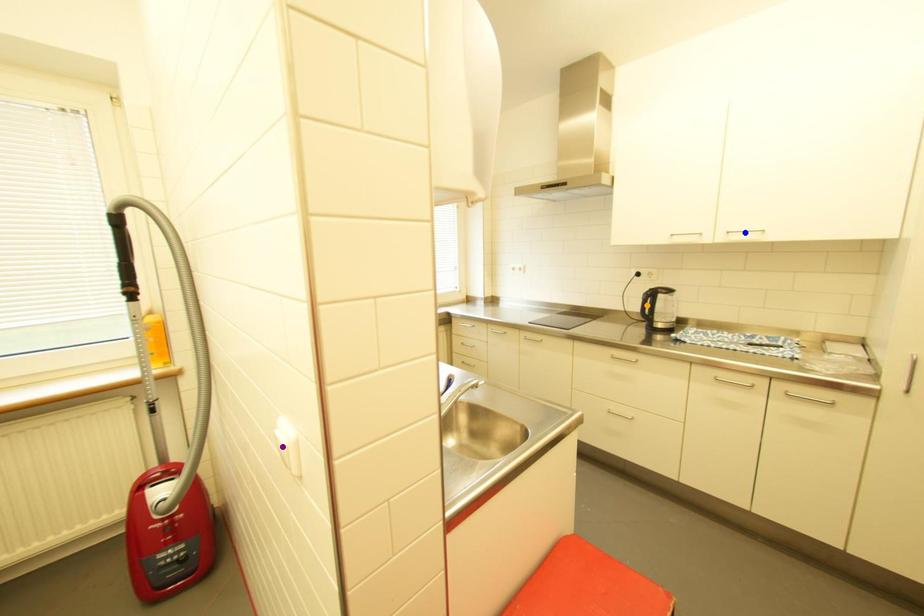
Order these from nearest to farthest:
- blue point
- purple point
- orange point

orange point
blue point
purple point